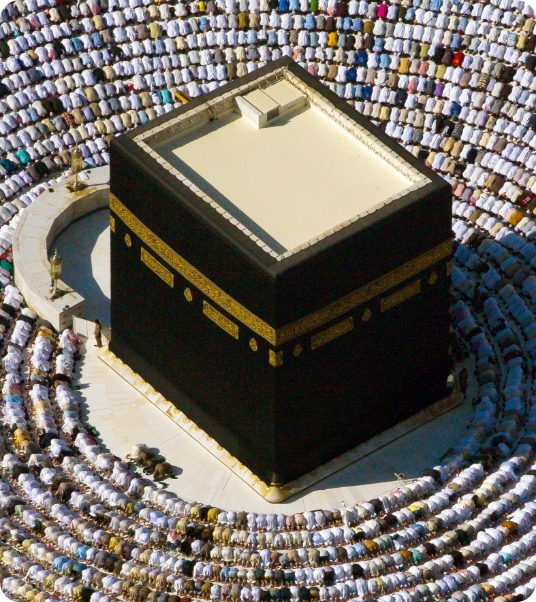
The height and width of the screenshot is (602, 536). In order to click on light in this screenshot , I will do `click(55, 270)`.